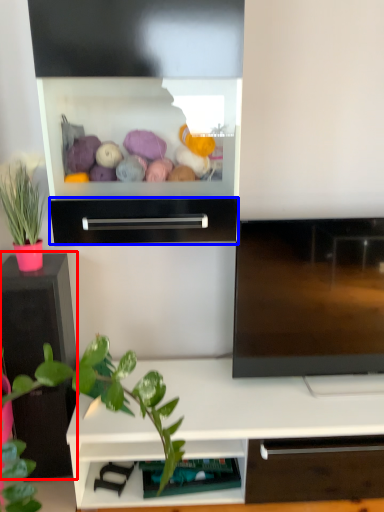
Question: Which of the following is the closest to the observer, tv cabinet (highlighted by a red box) or drawer (highlighted by a blue box)?

Choices:
 (A) tv cabinet
 (B) drawer

Answer: (B)